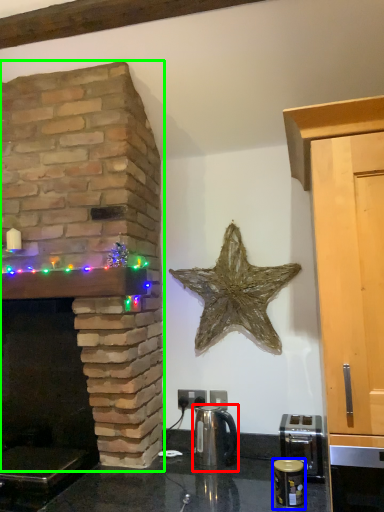
Question: Estimate the real-world distances between objects in this image. Which object is farther from tea pot (highlighted by a red box), appliance (highlighted by a blue box) or fireplace (highlighted by a green box)?

Choices:
 (A) appliance
 (B) fireplace

Answer: (B)